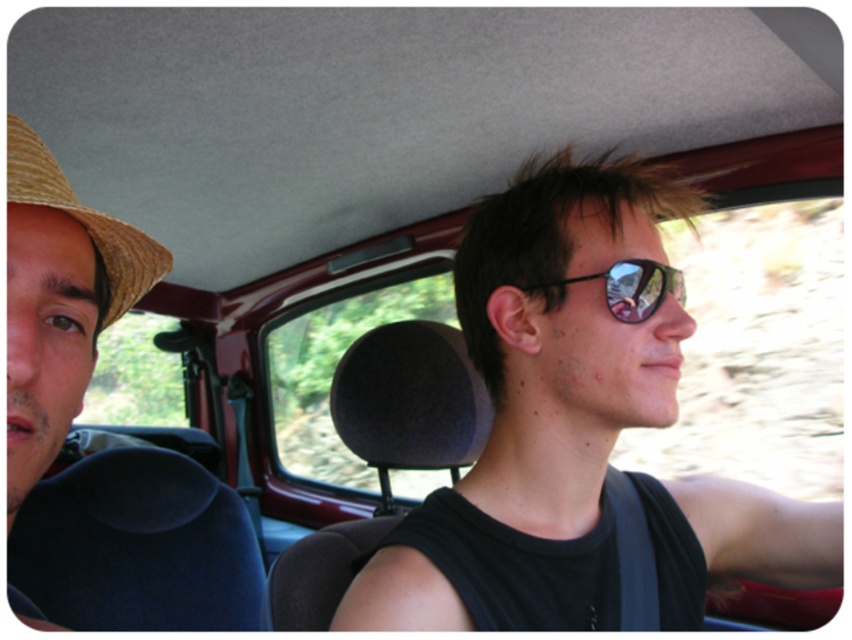
Question: Estimate the real-world distances between objects in this image. Which object is closer to the black reflective sunglasses at center?

Choices:
 (A) straw hat at left
 (B) braided straw cowboy hat at upper left
 (C) sunglasses at center

Answer: (C)

Question: Does sunglasses at center appear on the left side of braided straw cowboy hat at upper left?

Choices:
 (A) yes
 (B) no

Answer: (B)

Question: Can you confirm if straw hat at left is positioned above black reflective sunglasses at center?

Choices:
 (A) yes
 (B) no

Answer: (B)

Question: Which point is closer to the camera?

Choices:
 (A) (65, 371)
 (B) (554, 502)

Answer: (A)

Question: Which point is farther to the camera?

Choices:
 (A) (136, 260)
 (B) (665, 291)
 (C) (821, 586)

Answer: (C)

Question: Does sunglasses at center lie in front of braided straw cowboy hat at upper left?

Choices:
 (A) no
 (B) yes

Answer: (A)